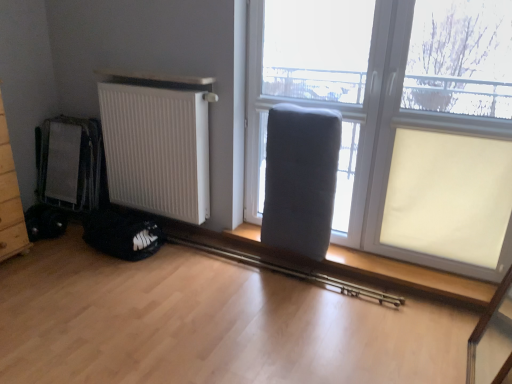
Question: Is the position of white matte radiator at left less distant than that of matte gray cushion at center?

Choices:
 (A) yes
 (B) no

Answer: (B)

Question: Considering the relative sizes of white matte radiator at left and matte gray cushion at center in the image provided, is white matte radiator at left wider than matte gray cushion at center?

Choices:
 (A) yes
 (B) no

Answer: (A)

Question: Is matte gray cushion at center located within white matte radiator at left?

Choices:
 (A) yes
 (B) no

Answer: (B)

Question: Is white matte radiator at left beside matte gray cushion at center?

Choices:
 (A) no
 (B) yes

Answer: (A)

Question: From the image's perspective, is white matte radiator at left above matte gray cushion at center?

Choices:
 (A) yes
 (B) no

Answer: (B)

Question: Is matte gray radiator at lower center wider or thinner than white matte radiator at left?

Choices:
 (A) thin
 (B) wide

Answer: (A)

Question: Considering their positions, is matte gray radiator at lower center located in front of or behind white matte radiator at left?

Choices:
 (A) behind
 (B) front

Answer: (B)

Question: Does point (371, 67) appear closer or farther from the camera than point (177, 137)?

Choices:
 (A) closer
 (B) farther

Answer: (A)

Question: In the image, is matte gray radiator at lower center on the left side or the right side of white matte radiator at left?

Choices:
 (A) right
 (B) left

Answer: (A)

Question: Considering the positions of white matte radiator at left and matte gray cushion at center in the image, is white matte radiator at left wider or thinner than matte gray cushion at center?

Choices:
 (A) thin
 (B) wide

Answer: (B)

Question: Is white matte radiator at left situated inside matte gray cushion at center or outside?

Choices:
 (A) inside
 (B) outside

Answer: (B)

Question: Would you say white matte radiator at left is to the left or to the right of matte gray cushion at center in the picture?

Choices:
 (A) left
 (B) right

Answer: (A)

Question: Based on their sizes in the image, would you say white matte radiator at left is bigger or smaller than matte gray cushion at center?

Choices:
 (A) big
 (B) small

Answer: (A)

Question: In terms of height, does gray fabric armchair at center look taller or shorter compared to matte gray cushion at center?

Choices:
 (A) short
 (B) tall

Answer: (A)

Question: Is point (312, 178) closer or farther from the camera than point (362, 41)?

Choices:
 (A) farther
 (B) closer

Answer: (B)